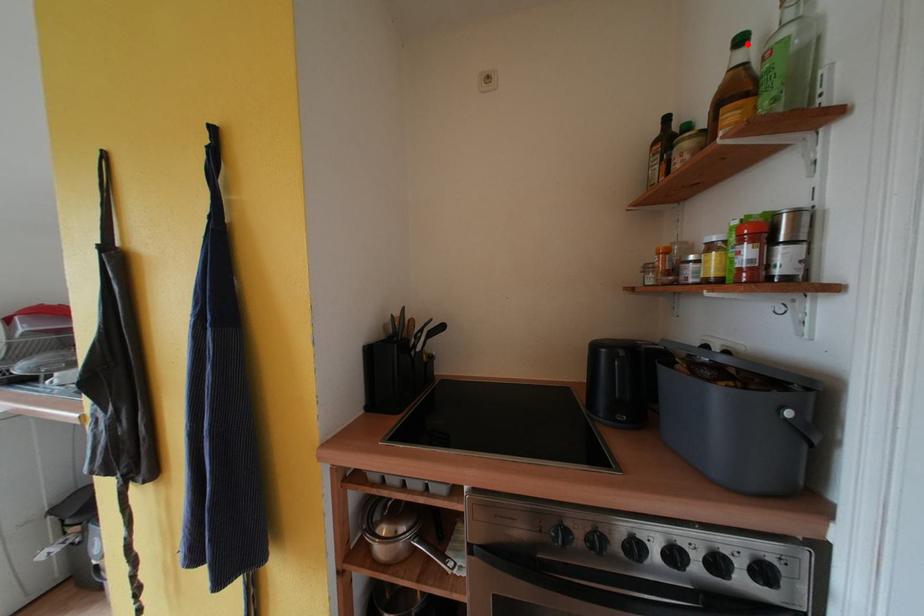
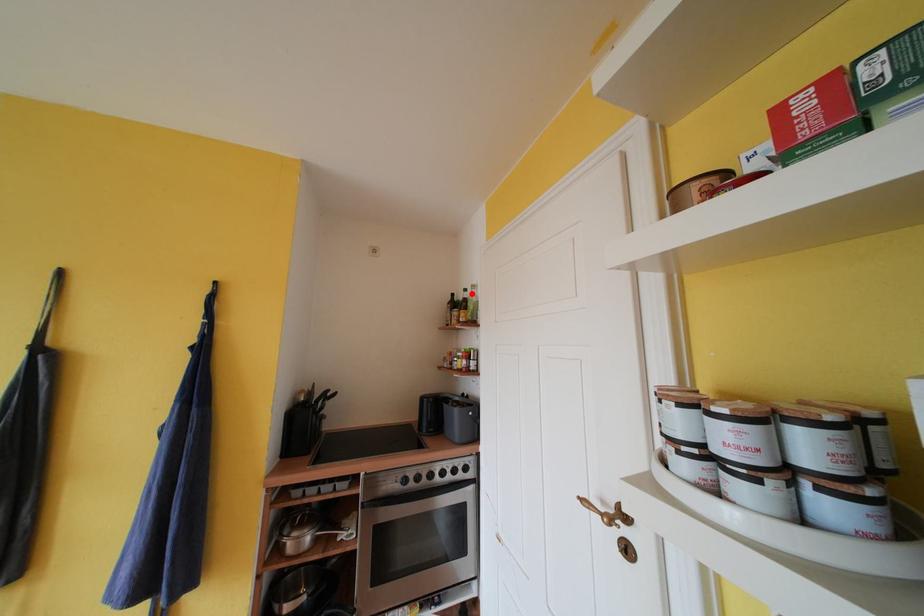
Based on the photo, I am providing you with two images of the same scene from different viewpoints. A red point is marked on the first image and another point is marked on the second image. Is the marked point in image1 the same physical position as the marked point in image2?

Yes